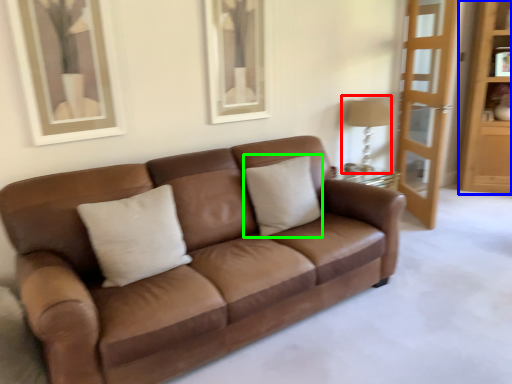
Question: Considering the real-world distances, which object is closest to table lamp (highlighted by a red box)? dresser (highlighted by a blue box) or pillow (highlighted by a green box).

Choices:
 (A) dresser
 (B) pillow

Answer: (B)